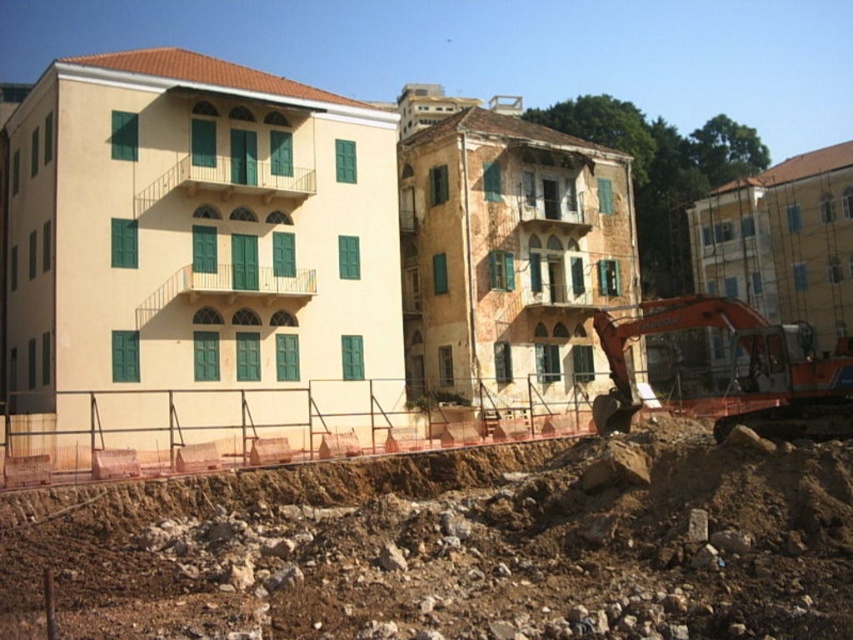
Question: Which object is farther from the camera taking this photo?

Choices:
 (A) orange metallic excavator at lower right
 (B) brown rocky dirt at lower center

Answer: (A)

Question: Does brown rocky dirt at lower center have a smaller size compared to orange metallic excavator at lower right?

Choices:
 (A) yes
 (B) no

Answer: (A)

Question: Which of the following is the closest to the observer?

Choices:
 (A) orange metallic excavator at lower right
 (B) brown rocky dirt at lower center

Answer: (B)

Question: Is brown rocky dirt at lower center closer to the viewer compared to orange metallic excavator at lower right?

Choices:
 (A) yes
 (B) no

Answer: (A)

Question: Is brown rocky dirt at lower center closer to the viewer compared to orange metallic excavator at lower right?

Choices:
 (A) no
 (B) yes

Answer: (B)